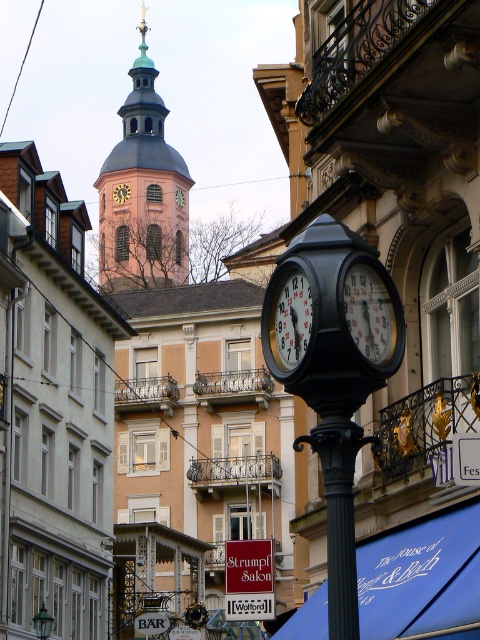
Where is `matte black clock at center`? The height and width of the screenshot is (640, 480). matte black clock at center is located at coordinates (121, 193).

Based on the photo, between matte black clock at center and wooden clock at center, which one is positioned higher?

Positioned higher is matte black clock at center.

The image size is (480, 640). What do you see at coordinates (121, 193) in the screenshot?
I see `matte black clock at center` at bounding box center [121, 193].

The image size is (480, 640). I want to click on matte black clock at center, so click(x=121, y=193).

Is point (128, 248) behind point (48, 632)?

Yes, point (128, 248) is farther from viewer.

Between pink stone clock tower at upper center and green glass lamp post at center, which one has more height?

pink stone clock tower at upper center

Describe the element at coordinates (143, 193) in the screenshot. I see `pink stone clock tower at upper center` at that location.

This screenshot has width=480, height=640. I want to click on pink stone clock tower at upper center, so click(x=143, y=193).

Can you confirm if metallic clock face at center is positioned to the left of green glass lamp post at center?

No, metallic clock face at center is not to the left of green glass lamp post at center.

Is metallic clock face at center bigger than green glass lamp post at center?

No.

Find the location of a particular element. This screenshot has height=640, width=480. metallic clock face at center is located at coordinates (370, 314).